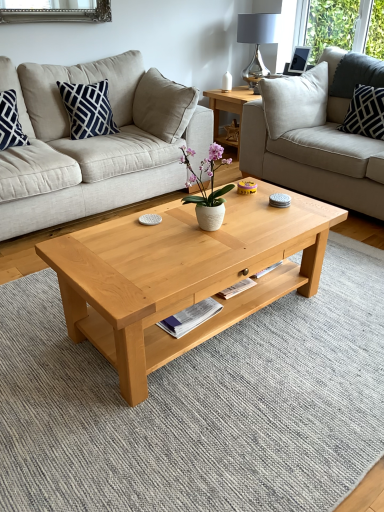
Identify the location of free space to the back side of white ceramic vase at center. (192, 219).